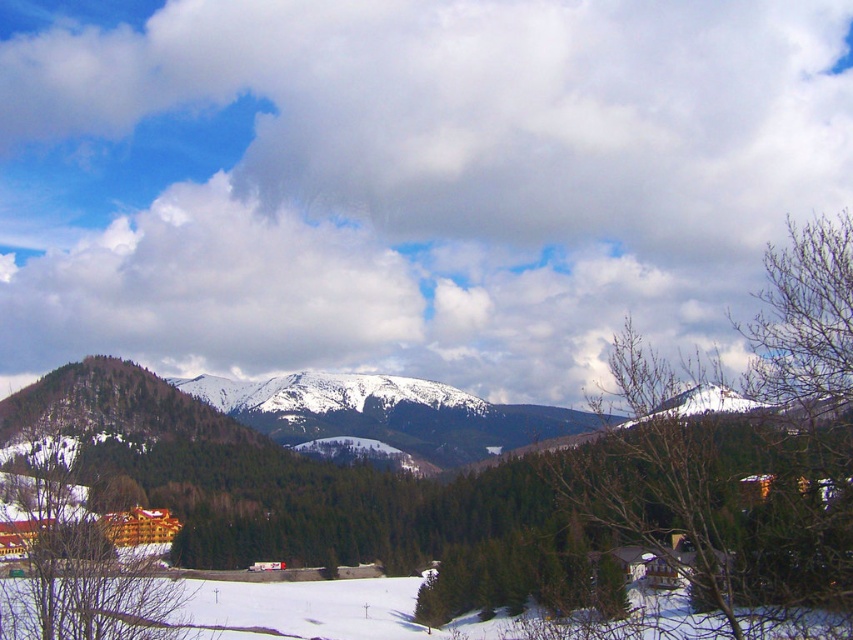
Question: Which of the following is the farthest from the observer?

Choices:
 (A) white fluffy cloud at upper center
 (B) green matte tree at lower left

Answer: (A)

Question: Which object appears farthest from the camera in this image?

Choices:
 (A) white fluffy cloud at upper center
 (B) green matte tree at lower left

Answer: (A)

Question: Can you confirm if white fluffy cloud at upper center is positioned to the right of green matte tree at lower left?

Choices:
 (A) no
 (B) yes

Answer: (B)

Question: Does white fluffy cloud at upper center have a larger size compared to green matte tree at lower left?

Choices:
 (A) yes
 (B) no

Answer: (A)

Question: Is white fluffy cloud at upper center below green matte tree at lower left?

Choices:
 (A) yes
 (B) no

Answer: (B)